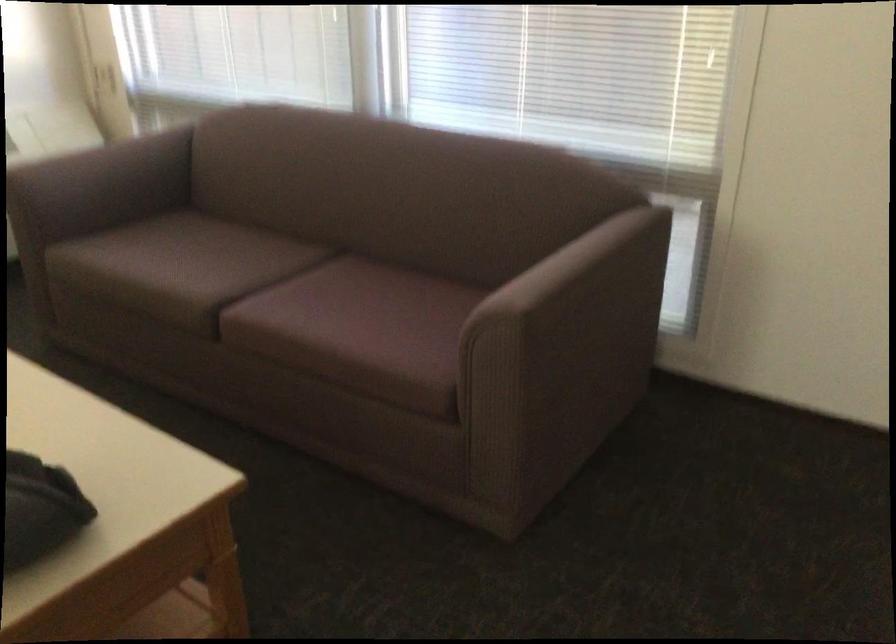
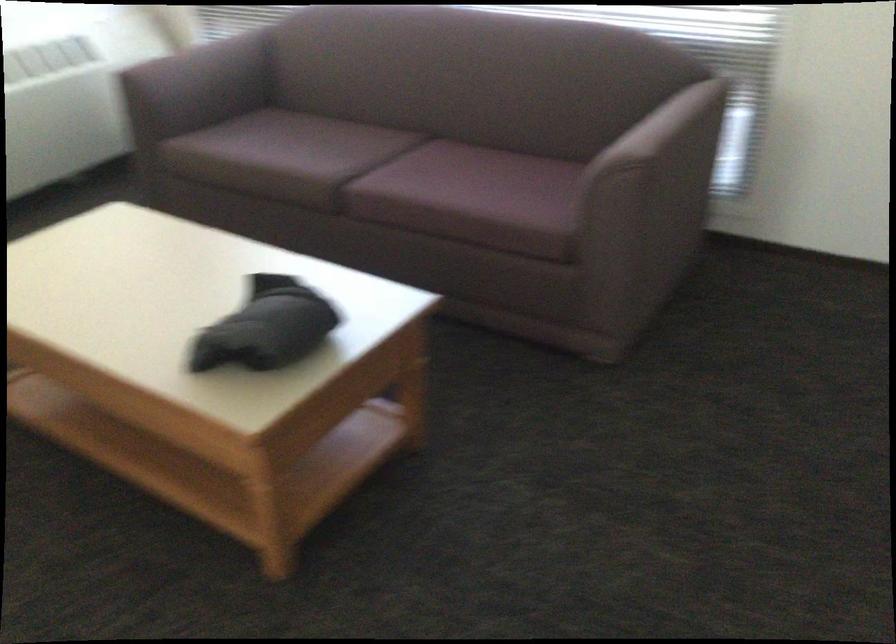
Question: How did the camera likely rotate?

Choices:
 (A) Left
 (B) Right
 (C) Up
 (D) Down

Answer: (D)